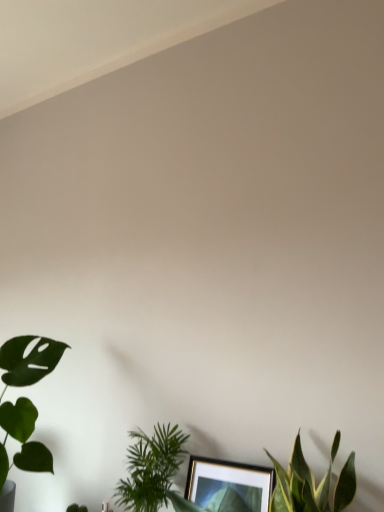
Question: Based on their sizes in the image, would you say green leafy plant at lower center, arranged as the second houseplant when viewed from the right, is bigger or smaller than green leafy plant at lower left?

Choices:
 (A) small
 (B) big

Answer: (B)

Question: From a real-world perspective, is green leafy plant at lower center, placed as the second houseplant when sorted from left to right, above or below green leafy plant at lower left?

Choices:
 (A) below
 (B) above

Answer: (B)

Question: Which object is positioned farthest from the green leafy plant at lower center, placed as the second houseplant when sorted from left to right?

Choices:
 (A) green matte leaf at lower left, placed as the first houseplant when sorted from left to right
 (B) green leafy plant at lower left
 (C) green leafy plant at lower center, which is the 3th houseplant in left-to-right order

Answer: (B)

Question: Considering the real-world distances, which object is closest to the green matte leaf at lower left, which is the 3th houseplant in right-to-left order?

Choices:
 (A) green leafy plant at lower left
 (B) green leafy plant at lower center, positioned as the first houseplant in right-to-left order
 (C) green leafy plant at lower center, placed as the second houseplant when sorted from left to right

Answer: (C)